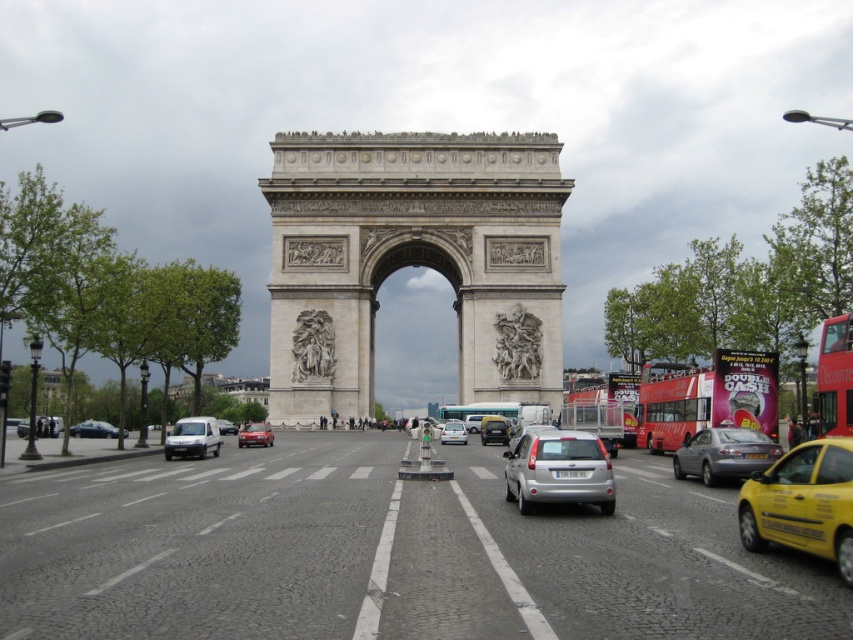
Which is behind, point (741, 440) or point (57, 426)?

Positioned behind is point (57, 426).

Who is lower down, silver metallic sedan at center or matte black car at left?

silver metallic sedan at center is lower down.

The image size is (853, 640). What are the coordinates of `silver metallic sedan at center` in the screenshot? It's located at (724, 454).

Who is taller, red double-decker bus at center right or satin silver sedan at center?

Standing taller between the two is red double-decker bus at center right.

Who is more distant from viewer, (846, 410) or (505, 429)?

The point (505, 429) is behind.

Identify the location of red double-decker bus at center right. (834, 378).

Is metallic silver bus at center bigger than satin silver sedan at center?

Correct, metallic silver bus at center is larger in size than satin silver sedan at center.

Between metallic silver bus at center and satin silver sedan at center, which one is positioned lower?

satin silver sedan at center

Find the location of `metallic silver bus at center`. metallic silver bus at center is located at coordinates pyautogui.click(x=497, y=412).